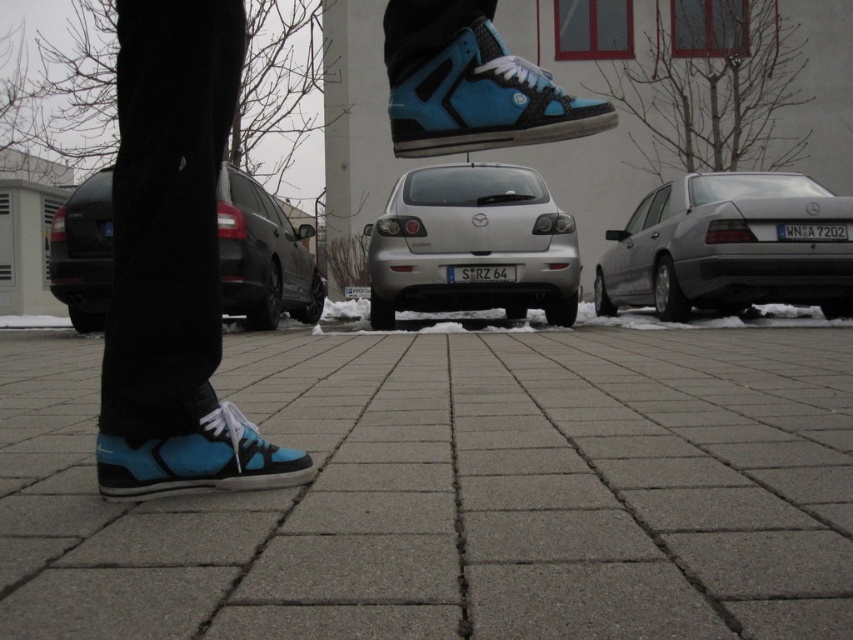
You are a photographer standing at the camera position. You need to place two markers on the ground at the coordinates point [280,253] and point [258,465]. Which marker will be closer to your current position?

Point [258,465] will be closer to your current position because it is closer to the camera than point [280,253], which is further away.

You are a delivery person who needs to park your van between the silver metallic sedan at right and the black matte car at center. Your van is 7 feet long. Is there enough space between them to park your van?

The distance between the silver metallic sedan at right and the black matte car at center is 9.38 feet. Since your van is 7 feet long, there is enough space to park between them as 9.38 feet is greater than 7 feet.

You are a pedestrian standing at the edge of the pavement and want to walk to the black matte car at center. Do you need to walk past the silver metallic sedan at right first?

The silver metallic sedan at right is further to the viewer than black matte car at center, so you would need to walk past the silver metallic sedan at right to reach the black matte car at center since it is closer to your starting position.